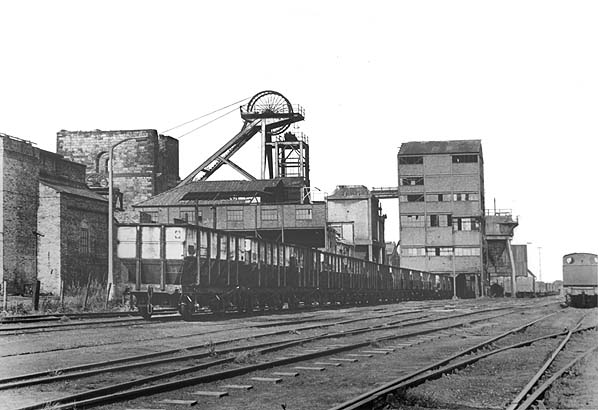
Where is `windows`? Image resolution: width=598 pixels, height=410 pixels. windows is located at coordinates (466, 249), (443, 252), (410, 251).